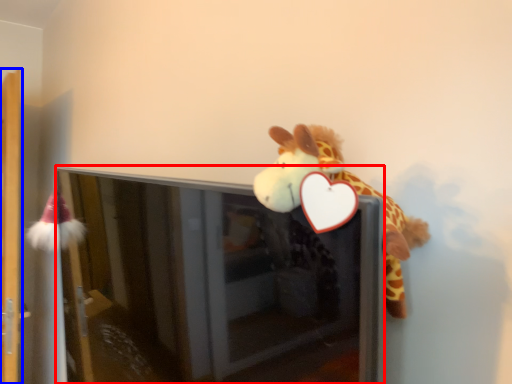
Question: Which point is closer to the camera, screen door (highlighted by a red box) or shelf (highlighted by a blue box)?

Choices:
 (A) screen door
 (B) shelf

Answer: (A)